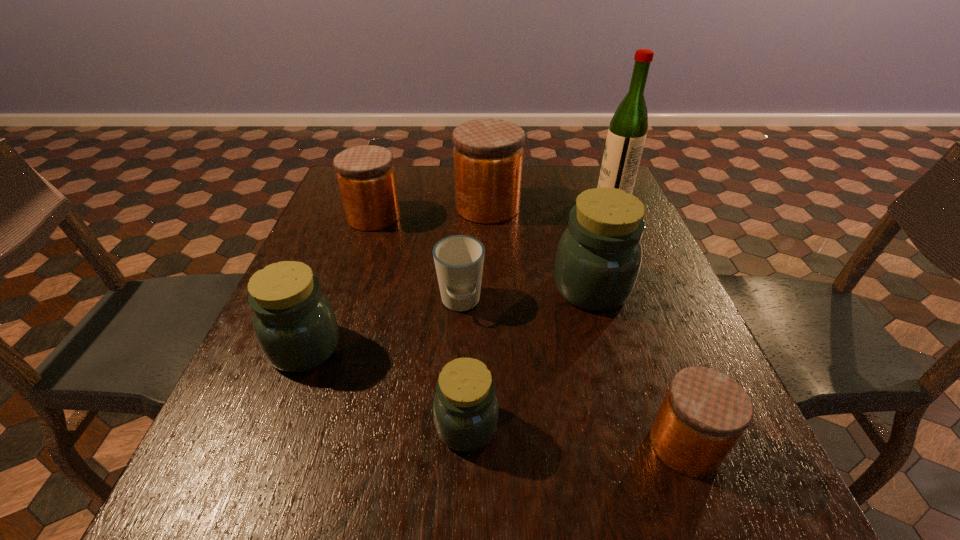
Image resolution: width=960 pixels, height=540 pixels. I want to click on jar identified as the fourth closest to the smallest orange jar, so click(x=488, y=153).

Identify the location of jar that is the third nearest to the second biggest green jar. (488, 153).

Identify which orange jar is located as the nearest to the farthest green jar. Please provide its 2D coordinates. Your answer should be formatted as a tuple, i.e. [(x, y)], where the tuple contains the x and y coordinates of a point satisfying the conditions above.

[(488, 153)]

You are a GUI agent. You are given a task and a screenshot of the screen. Output one action in this format:
    pyautogui.click(x=<x>, y=<y>)
    Task: Click on the orange jar that is the third closest to the biggest green jar
    The height and width of the screenshot is (540, 960).
    Given the screenshot: What is the action you would take?
    (x=366, y=177)

Find the location of `green jar that can be found as the closest to the green liquor`. green jar that can be found as the closest to the green liquor is located at coordinates (598, 259).

What are the coordinates of `the closest green jar to the leftmost green jar` in the screenshot? It's located at (465, 409).

You are a GUI agent. You are given a task and a screenshot of the screen. Output one action in this format:
    pyautogui.click(x=<x>, y=<y>)
    Task: Click on the free region that satisfies the following two spatial constraints: 1. with a handle on the side of the smallest orange jar; 2. on the right side of the white cup
    
    Given the screenshot: What is the action you would take?
    pyautogui.click(x=454, y=444)

Locate an element on the screen. This screenshot has height=540, width=960. free space that satisfies the following two spatial constraints: 1. on the back side of the third farthest jar; 2. on the left side of the second green jar from right to left is located at coordinates (470, 288).

Locate an element on the screen. This screenshot has height=540, width=960. vacant point that satisfies the following two spatial constraints: 1. on the front side of the smallest orange jar; 2. on the right side of the second smallest orange jar is located at coordinates (300, 444).